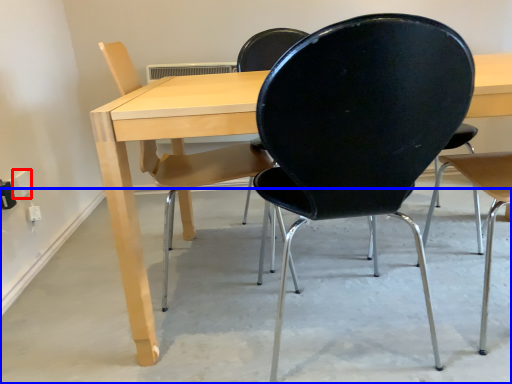
Question: Which of the following is the closest to the observer, electric outlet (highlighted by a red box) or concrete (highlighted by a blue box)?

Choices:
 (A) electric outlet
 (B) concrete

Answer: (B)